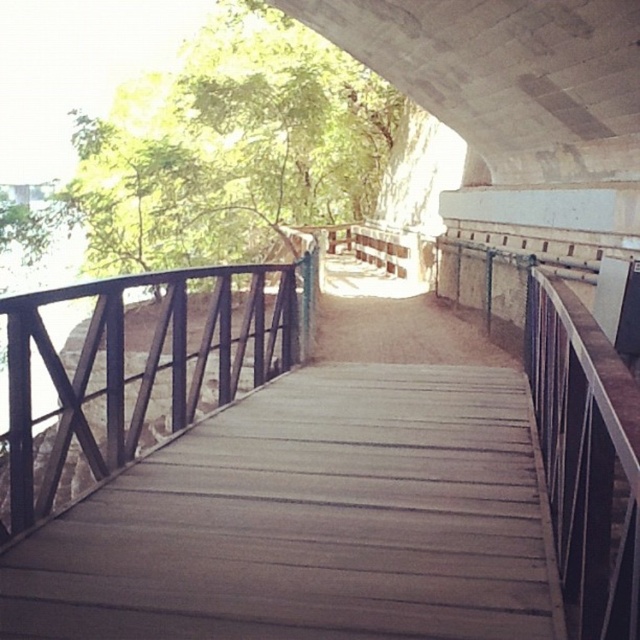
You are standing on the walkway under the bridge and want to place a small potted plant between the brown wooden bridge at center and the brown wooden rail at center. According to the scene description, which object should the plant be placed closer to?

The brown wooden bridge at center is above the brown wooden rail at center, so the plant should be placed closer to the brown wooden rail at center since it is lower.

In the scene shown: You are a pedestrian carrying a wide box that is 1 meter in width. You need to walk across the brown wooden bridge at center while avoiding the brown wooden rail at center. Is the bridge wide enough for you to pass safely with your box?

The brown wooden bridge at center is thinner than the brown wooden rail at center. Since the bridge is thinner, it might not be wide enough to accommodate a 1 meter wide box safely. You should check the actual width before proceeding.

You are standing at the entrance of the walkway and want to reach the brown wooden bridge at center. According to the coordinates given, in which direction should you walk to reach it?

The brown wooden bridge at center is located at coordinates point (308, 486), so you should walk forward towards the center of the walkway to reach it.